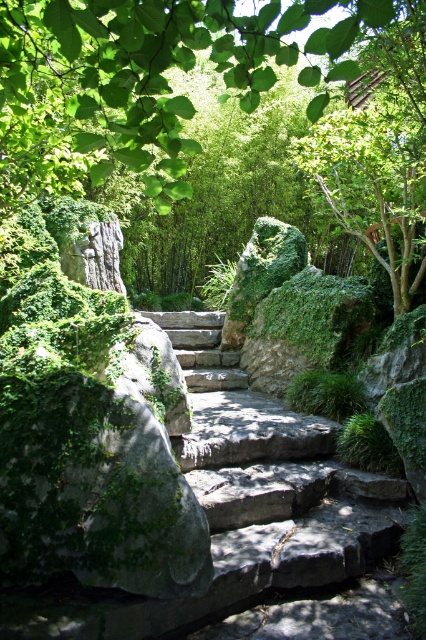
Does green leafy tree at upper center come behind dark gray stone stairs at center?

No, green leafy tree at upper center is closer to the viewer.

Which is above, green leafy tree at upper center or dark gray stone stairs at center?

Positioned higher is green leafy tree at upper center.

Find the location of a particular element. This screenshot has width=426, height=640. green leafy tree at upper center is located at coordinates (141, 77).